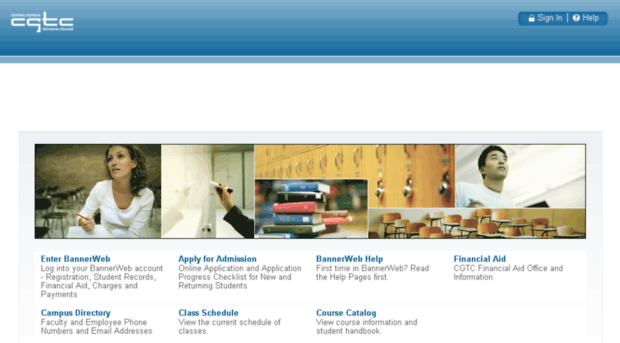
This screenshot has height=343, width=620. What are the coordinates of `markers` in the screenshot? It's located at (202, 224), (211, 228), (213, 184).